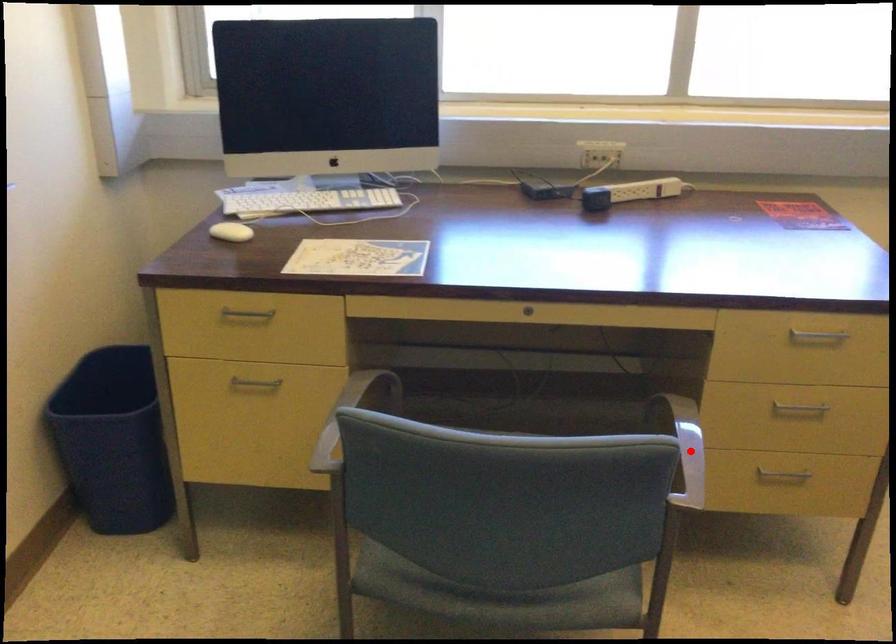
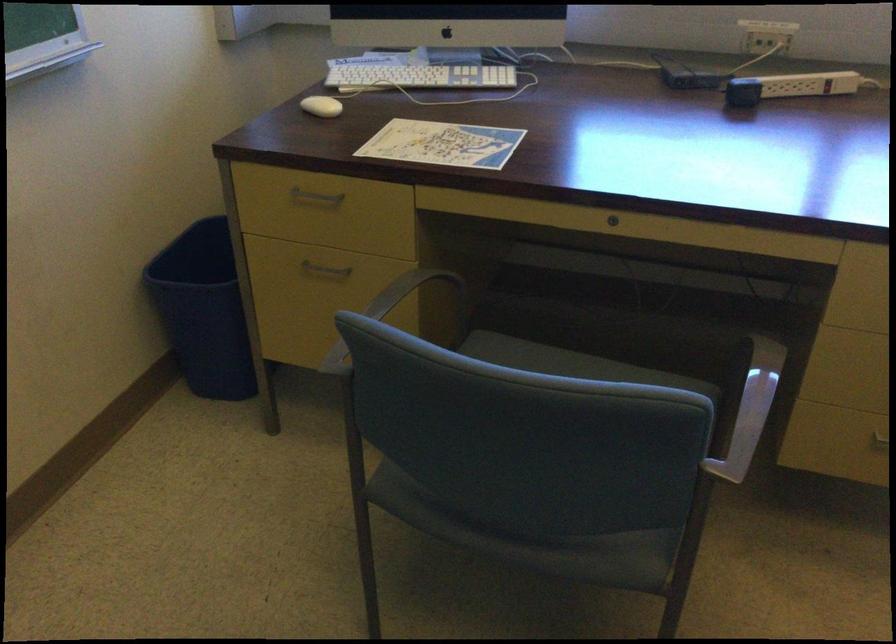
Question: I am providing you with two images of the same scene from different viewpoints. Given a red point in image1, look at the same physical point in image2. Is it:

Choices:
 (A) Closer to the viewpoint
 (B) Farther from the viewpoint

Answer: (A)